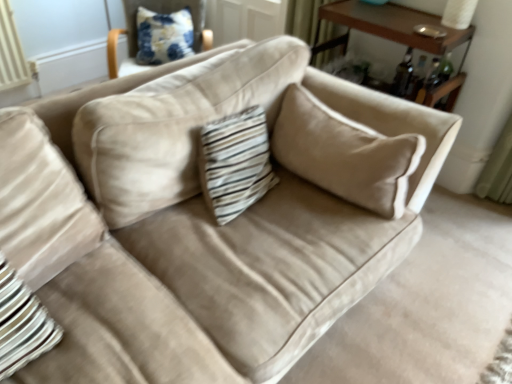
Question: Should I look upward or downward to see white paper lampshade at upper right?

Choices:
 (A) up
 (B) down

Answer: (A)

Question: Is brown wood table at upper right outside white paper lampshade at upper right?

Choices:
 (A) yes
 (B) no

Answer: (A)

Question: Is brown wood table at upper right closer to the viewer compared to white paper lampshade at upper right?

Choices:
 (A) yes
 (B) no

Answer: (A)

Question: Considering the relative sizes of brown wood table at upper right and white paper lampshade at upper right in the image provided, is brown wood table at upper right wider than white paper lampshade at upper right?

Choices:
 (A) no
 (B) yes

Answer: (B)

Question: Is brown wood table at upper right facing away from white paper lampshade at upper right?

Choices:
 (A) no
 (B) yes

Answer: (A)

Question: Considering the relative sizes of brown wood table at upper right and white paper lampshade at upper right in the image provided, is brown wood table at upper right thinner than white paper lampshade at upper right?

Choices:
 (A) yes
 (B) no

Answer: (B)

Question: Would you say brown wood table at upper right is a long distance from white paper lampshade at upper right?

Choices:
 (A) no
 (B) yes

Answer: (A)

Question: Is white paper lampshade at upper right positioned behind brown wood table at upper right?

Choices:
 (A) no
 (B) yes

Answer: (B)

Question: Is white paper lampshade at upper right beside brown wood table at upper right?

Choices:
 (A) yes
 (B) no

Answer: (B)

Question: Is white paper lampshade at upper right not close to brown wood table at upper right?

Choices:
 (A) no
 (B) yes

Answer: (A)

Question: From the image's perspective, is white paper lampshade at upper right above brown wood table at upper right?

Choices:
 (A) no
 (B) yes

Answer: (B)

Question: Considering the relative sizes of white paper lampshade at upper right and brown wood table at upper right in the image provided, is white paper lampshade at upper right taller than brown wood table at upper right?

Choices:
 (A) yes
 (B) no

Answer: (B)

Question: Can you confirm if white paper lampshade at upper right is smaller than brown wood table at upper right?

Choices:
 (A) no
 (B) yes

Answer: (B)

Question: Is brown wood table at upper right at the right side of blue printed fabric pillow at upper left?

Choices:
 (A) no
 (B) yes

Answer: (B)